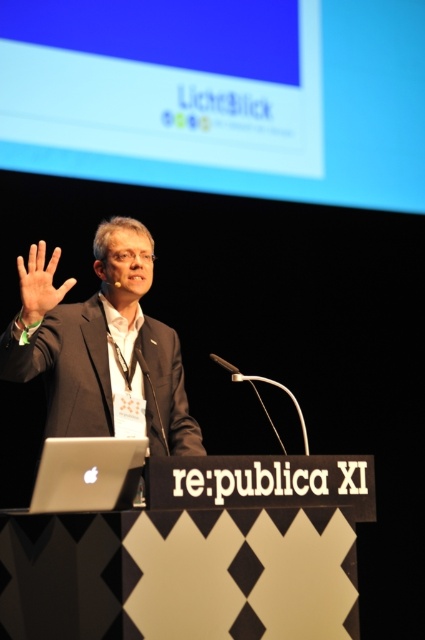
You are standing at the conference and want to move from point A to point B. Point A is at coordinates point(99, 93) and point B is at point(64, 476). Which point is closer to you?

Point A at coordinates point(99, 93) is closer to you because it is further to the viewer than point B at point(64, 476).

You are a photographer at the conference and need to capture a photo where both the dark gray suit at center and the matte black hand at upper left are in focus. Given that your camera has a depth of field that can cover 13 inches, will both objects be in focus?

The distance between the dark gray suit at center and the matte black hand at upper left is 12.97 inches, which is within the camera depth of field of 13 inches. Therefore, both objects will be in focus.